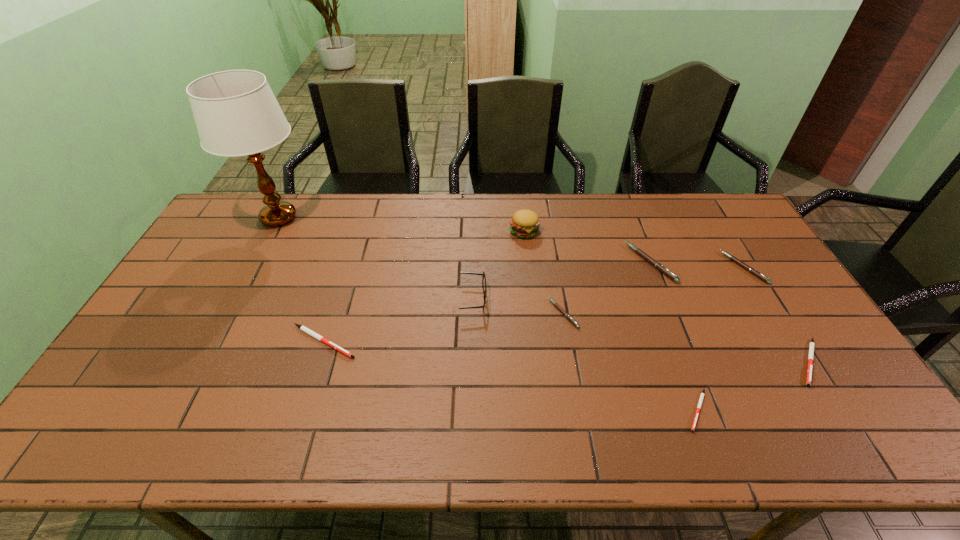
Locate an element on the screen. This screenshot has height=540, width=960. the smallest pink pen is located at coordinates (556, 305).

Where is `the fifth pen from right to left`? This screenshot has width=960, height=540. the fifth pen from right to left is located at coordinates (556, 305).

This screenshot has height=540, width=960. Identify the location of the rightmost white pen. (811, 348).

I want to click on the shortest pen, so click(x=702, y=394).

In order to click on the nearest white pen in this screenshot , I will do `click(702, 394)`.

Find the location of `free space located on the front of the table lamp`. free space located on the front of the table lamp is located at coordinates (258, 257).

At what (x,y) coordinates should I click in order to perform the action: click on blank area located 0.060m on the front of the hamburger. Please return your answer as a coordinate pair (x, y). This screenshot has height=540, width=960. Looking at the image, I should click on (526, 253).

This screenshot has height=540, width=960. In order to click on vacant space located on the front-facing side of the third tallest object in this screenshot , I will do `click(507, 299)`.

This screenshot has width=960, height=540. I want to click on free space located 0.180m at the nib of the tallest pen, so click(x=575, y=263).

The height and width of the screenshot is (540, 960). I want to click on free space located at the nib of the tallest pen, so click(x=514, y=263).